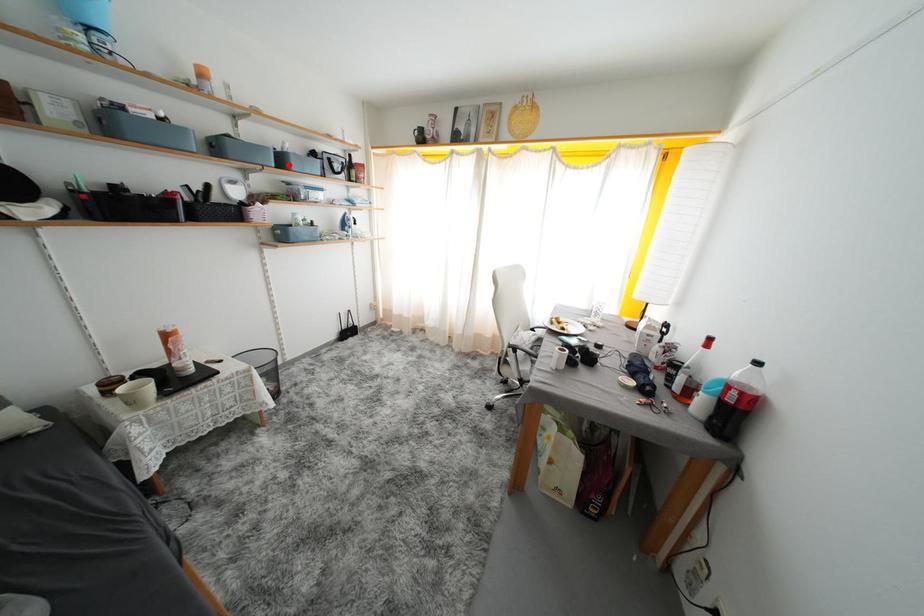
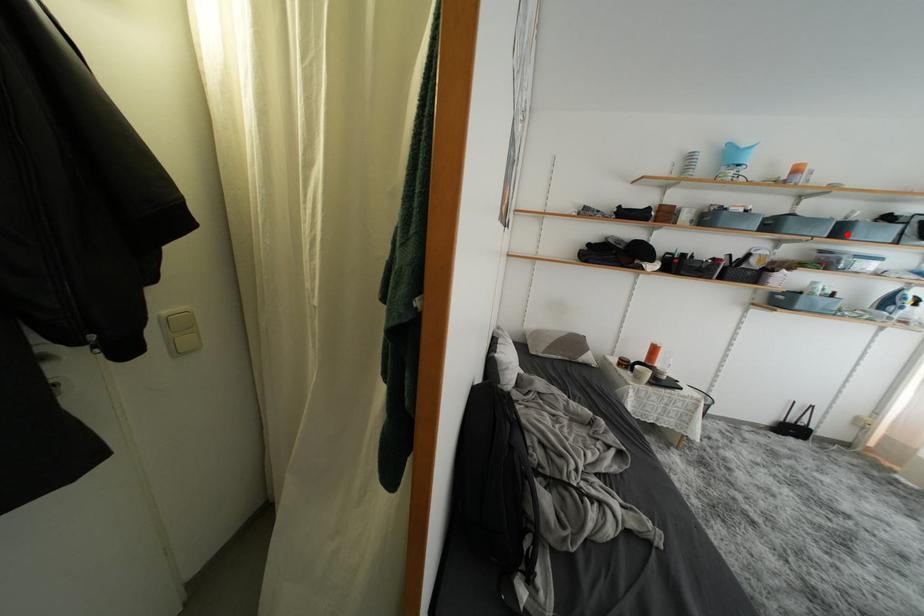
I am providing you with two images of the same scene from different viewpoints. A red point is marked on the first image and another point is marked on the second image. Is the red point in image1 aligned with the point shown in image2?

Yes